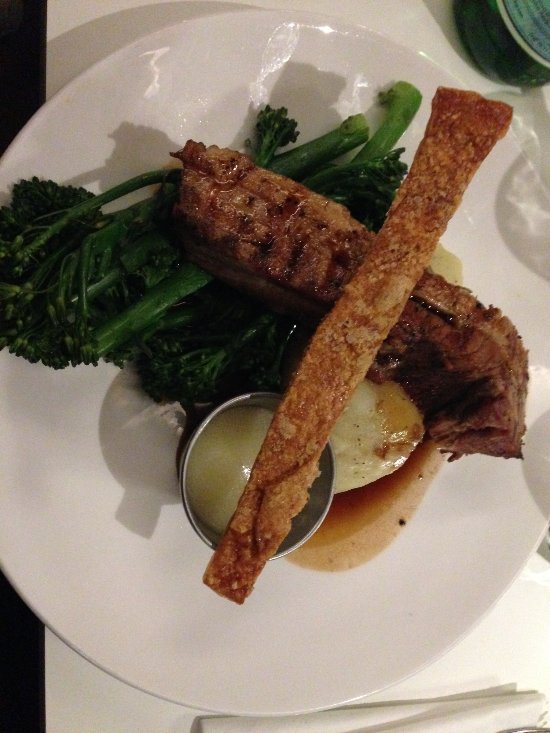
In order to click on plate in this screenshot , I will do `click(84, 475)`.